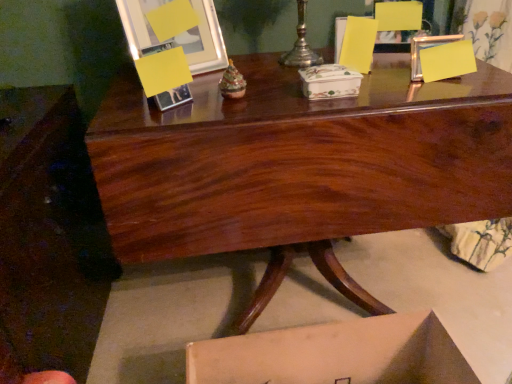
What do you see at coordinates (399, 16) in the screenshot? This screenshot has height=384, width=512. I see `matte wood armchair at upper right` at bounding box center [399, 16].

Based on the photo, in order to face glossy wood desk at center, should I rotate leftwards or rightwards?

To face it directly, rotate right by 5.929 degrees.

Identify the location of silver metallic candle holder at upper center. (301, 45).

Measure the distance between porcelain floral box at center and camera.

They are 36.22 inches apart.

Describe the element at coordinates (178, 34) in the screenshot. The image size is (512, 384). I see `metallic silver picture frame at upper left` at that location.

What are the coordinates of `matte wood armchair at upper right` in the screenshot? It's located at (399, 16).

Who is bigger, silver metallic candle holder at upper center or metallic silver picture frame at upper left?

With larger size is metallic silver picture frame at upper left.

From the image's perspective, is silver metallic candle holder at upper center on top of metallic silver picture frame at upper left?

Yes.

Considering the points (263, 172) and (302, 51), which point is in front, point (263, 172) or point (302, 51)?

The point (263, 172) is closer.

Is the depth of glossy wood desk at center greater than that of silver metallic candle holder at upper center?

No, glossy wood desk at center is in front of silver metallic candle holder at upper center.

Does glossy wood desk at center turn towards silver metallic candle holder at upper center?

No, glossy wood desk at center is not facing towards silver metallic candle holder at upper center.

Can you confirm if glossy wood desk at center is taller than silver metallic candle holder at upper center?

Correct, glossy wood desk at center is much taller as silver metallic candle holder at upper center.

Is silver metallic candle holder at upper center shorter than porcelain floral box at center?

In fact, silver metallic candle holder at upper center may be taller than porcelain floral box at center.

Is silver metallic candle holder at upper center turned away from porcelain floral box at center?

That's not correct — silver metallic candle holder at upper center is not looking away from porcelain floral box at center.

Consider the image. Considering the relative positions of silver metallic candle holder at upper center and porcelain floral box at center in the image provided, is silver metallic candle holder at upper center to the right of porcelain floral box at center from the viewer's perspective?

No.

Is point (356, 74) closer or farther from the camera than point (208, 27)?

Point (356, 74).

Relative to metallic silver picture frame at upper left, is porcelain floral box at center in front or behind?

Clearly, porcelain floral box at center is in front of metallic silver picture frame at upper left.

Considering the relative sizes of porcelain floral box at center and metallic silver picture frame at upper left in the image provided, is porcelain floral box at center taller than metallic silver picture frame at upper left?

Incorrect, the height of porcelain floral box at center is not larger of that of metallic silver picture frame at upper left.

How many degrees apart are the facing directions of porcelain floral box at center and metallic silver picture frame at upper left?

The angle between the facing direction of porcelain floral box at center and the facing direction of metallic silver picture frame at upper left is 27.8 degrees.

From the image's perspective, which one is positioned lower, porcelain floral box at center or glossy wood desk at center?

From the image's view, glossy wood desk at center is below.

Considering the relative sizes of porcelain floral box at center and glossy wood desk at center in the image provided, is porcelain floral box at center shorter than glossy wood desk at center?

Yes, porcelain floral box at center is shorter than glossy wood desk at center.

Considering the points (315, 81) and (296, 152), which point is behind, point (315, 81) or point (296, 152)?

Point (315, 81)

Which object is positioned more to the right, porcelain floral box at center or glossy wood desk at center?

porcelain floral box at center.

In the scene shown: Is matte wood armchair at upper right next to glossy wood desk at center?

No, matte wood armchair at upper right is not in contact with glossy wood desk at center.

Does matte wood armchair at upper right come behind glossy wood desk at center?

Yes, matte wood armchair at upper right is further from the viewer.

Considering the positions of point (413, 12) and point (351, 114), is point (413, 12) closer or farther from the camera than point (351, 114)?

Point (413, 12) appears to be farther away from the viewer than point (351, 114).

How different are the orientations of matte wood armchair at upper right and glossy wood desk at center in degrees?

There is a 18.4-degree angle between the facing directions of matte wood armchair at upper right and glossy wood desk at center.

Would you say matte wood armchair at upper right is inside or outside silver metallic candle holder at upper center?

The correct answer is: outside.

Identify the location of armchair below the silver metallic candle holder at upper center (from a real-world perspective). This screenshot has width=512, height=384. (399, 16).

Considering the sizes of objects matte wood armchair at upper right and silver metallic candle holder at upper center in the image provided, who is thinner, matte wood armchair at upper right or silver metallic candle holder at upper center?

matte wood armchair at upper right.

Locate an element on the screen. The width and height of the screenshot is (512, 384). candle holder above the metallic silver picture frame at upper left (from the image's perspective) is located at coordinates (301, 45).

Locate an element on the screen. The width and height of the screenshot is (512, 384). candle holder behind the glossy wood desk at center is located at coordinates (301, 45).

Based on their spatial positions, is glossy wood desk at center or matte wood armchair at upper right closer to metallic silver picture frame at upper left?

glossy wood desk at center is positioned closer to the anchor metallic silver picture frame at upper left.

Based on their spatial positions, is matte wood armchair at upper right or glossy wood desk at center further from metallic silver picture frame at upper left?

matte wood armchair at upper right is further to metallic silver picture frame at upper left.

From the image, which object appears to be nearer to silver metallic candle holder at upper center, metallic silver picture frame at upper left or porcelain floral box at center?

porcelain floral box at center is positioned closer to the anchor silver metallic candle holder at upper center.

Looking at the image, which one is located further to matte wood armchair at upper right, silver metallic candle holder at upper center or glossy wood desk at center?

glossy wood desk at center.

Looking at the image, which one is located closer to matte wood armchair at upper right, glossy wood desk at center or silver metallic candle holder at upper center?

Among the two, silver metallic candle holder at upper center is located nearer to matte wood armchair at upper right.

From the image, which object appears to be farther from matte wood armchair at upper right, silver metallic candle holder at upper center or porcelain floral box at center?

porcelain floral box at center.

Considering their positions, is metallic silver picture frame at upper left positioned closer to glossy wood desk at center than silver metallic candle holder at upper center?

Among the two, metallic silver picture frame at upper left is located nearer to glossy wood desk at center.

Estimate the real-world distances between objects in this image. Which object is closer to metallic silver picture frame at upper left, glossy wood desk at center or porcelain floral box at center?

glossy wood desk at center is positioned closer to the anchor metallic silver picture frame at upper left.

At what (x,y) coordinates should I click in order to perform the action: click on storage box between silver metallic candle holder at upper center and glossy wood desk at center in the up-down direction. Please return your answer as a coordinate pair (x, y). Image resolution: width=512 pixels, height=384 pixels. Looking at the image, I should click on (329, 82).

The image size is (512, 384). In order to click on candle holder between metallic silver picture frame at upper left and porcelain floral box at center from left to right in this screenshot , I will do `click(301, 45)`.

You are a GUI agent. You are given a task and a screenshot of the screen. Output one action in this format:
    pyautogui.click(x=<x>, y=<y>)
    Task: Click on the storage box between metallic silver picture frame at upper left and matte wood armchair at upper right in the horizontal direction
    
    Given the screenshot: What is the action you would take?
    pyautogui.click(x=329, y=82)

You are a GUI agent. You are given a task and a screenshot of the screen. Output one action in this format:
    pyautogui.click(x=<x>, y=<y>)
    Task: Click on the storage box between silver metallic candle holder at upper center and matte wood armchair at upper right
    
    Given the screenshot: What is the action you would take?
    pyautogui.click(x=329, y=82)